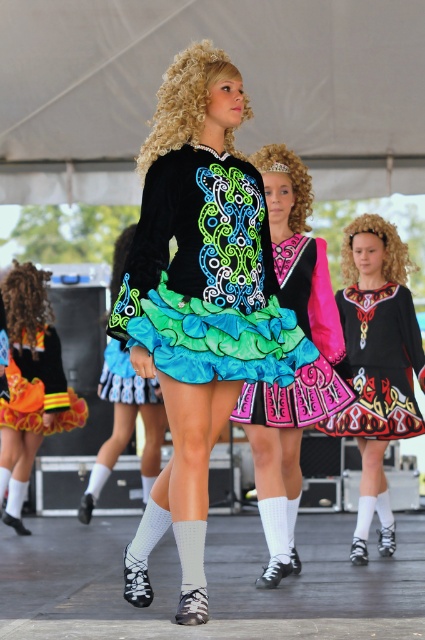
You are a photographer setting up a camera in the front row. You need to capture both the matte black and neon green dress at center and the matte black dress at center in the same frame. Which dress should you position closer to the camera to ensure both fit in the frame?

You should position the matte black and neon green dress at center closer to the camera because it is wider than the matte black dress at center. This way, the wider dress will take up more space in the frame, allowing both to be captured without cropping.

You are a photographer positioned at the center of the stage. You notice two points marked on the stage floor. The first point is labeled as point (317, 240) and the second as point (379, 358). Which point is closer to your current position?

Point (317, 240) is closer to your current position because it is in front of point (379, 358).